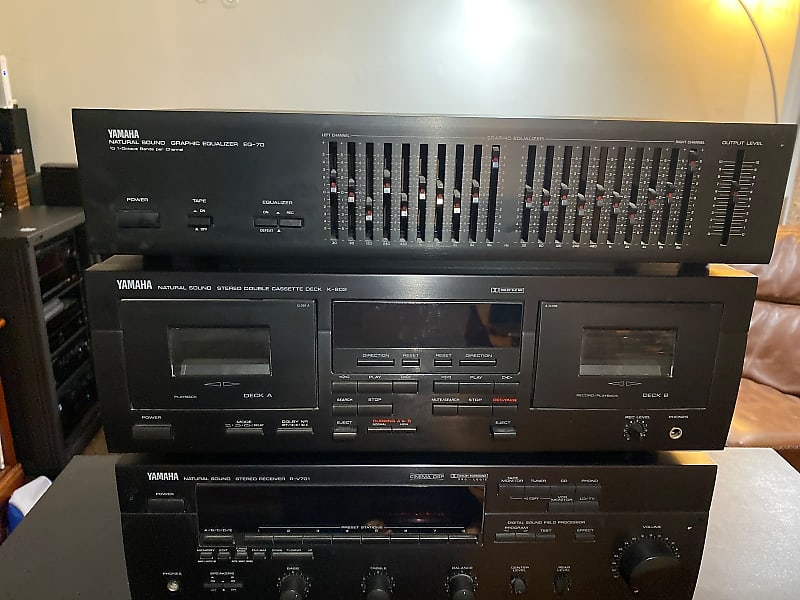
Locate an element on the screen. This screenshot has height=600, width=800. light is located at coordinates coord(740,18), coord(509,16).